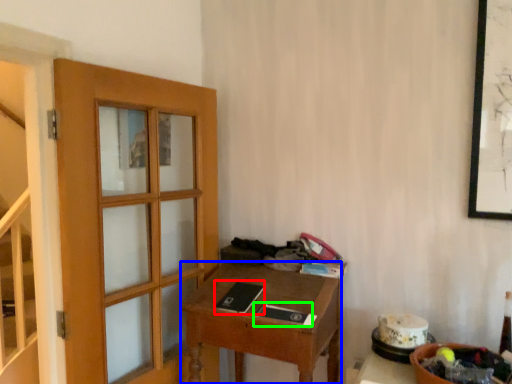
Question: Which is nearer to the book (highlighted by a red box)? desk (highlighted by a blue box) or book (highlighted by a green box).

Choices:
 (A) desk
 (B) book

Answer: (B)